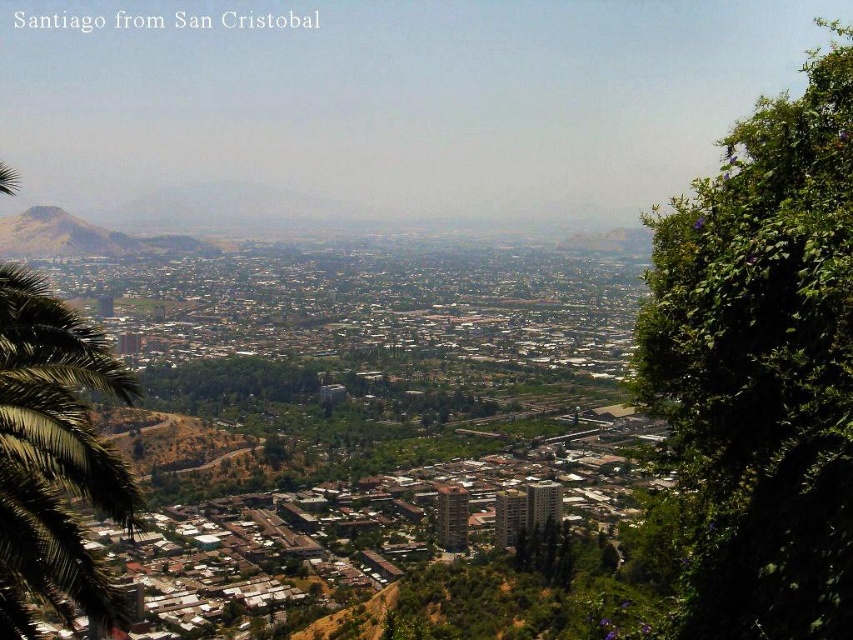
You are a landscape photographer planning to capture the entire Santiago skyline in one shot. You have a wide angle lens that can cover up to 10 meters in width. The green leafy tree at right and rustic brown hill at left are in your frame. Can your lens accommodate both objects in the shot?

The green leafy tree at right is wider than the rustic brown hill at left. Since the total width of both objects combined may exceed the lens capacity, it depends on their exact positions. However, the question states the tree is wider but not the distance between them. Without knowing the distance between the two objects, we cannot confirm if the lens can fit both.

You are a drone operator who needs to capture a photo of the green leafy tree at right from directly above. Given that your drone can fly up to 500 meters away from its starting position, will you be able to reach the tree?

The green leafy tree at right is 649.60 meters from camera. Since the drone can only fly up to 500 meters away, it cannot reach the tree.

You are a drone operator who needs to fly a drone from the green leafy palm tree at left to the green leafy tree at right. Based on the scene, can you determine which direction you should fly the drone to reach the destination?

The green leafy tree at right is located above the green leafy palm tree at left, so you should fly the drone upward to reach the destination.